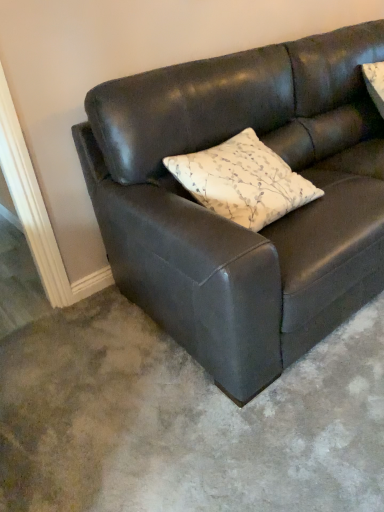
Question: Based on their sizes in the image, would you say white floral-patterned pillow at center is bigger or smaller than matte black couch at center?

Choices:
 (A) small
 (B) big

Answer: (A)

Question: Relative to matte black couch at center, is white floral-patterned pillow at center in front or behind?

Choices:
 (A) behind
 (B) front

Answer: (A)

Question: Considering the positions of white floral-patterned pillow at center and matte black couch at center in the image, is white floral-patterned pillow at center taller or shorter than matte black couch at center?

Choices:
 (A) short
 (B) tall

Answer: (A)

Question: Looking at the image, does matte black couch at center seem bigger or smaller compared to white floral-patterned pillow at center?

Choices:
 (A) big
 (B) small

Answer: (A)

Question: From the image's perspective, is matte black couch at center above or below white floral-patterned pillow at center?

Choices:
 (A) above
 (B) below

Answer: (A)

Question: Is matte black couch at center to the left or to the right of white floral-patterned pillow at center in the image?

Choices:
 (A) right
 (B) left

Answer: (A)

Question: Is matte black couch at center wider or thinner than white floral-patterned pillow at center?

Choices:
 (A) wide
 (B) thin

Answer: (A)